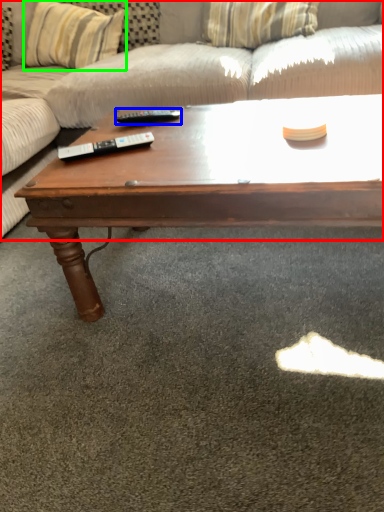
Question: Which object is the closest to the studio couch (highlighted by a red box)? Choose among these: remote (highlighted by a blue box) or pillow (highlighted by a green box).

Choices:
 (A) remote
 (B) pillow

Answer: (B)